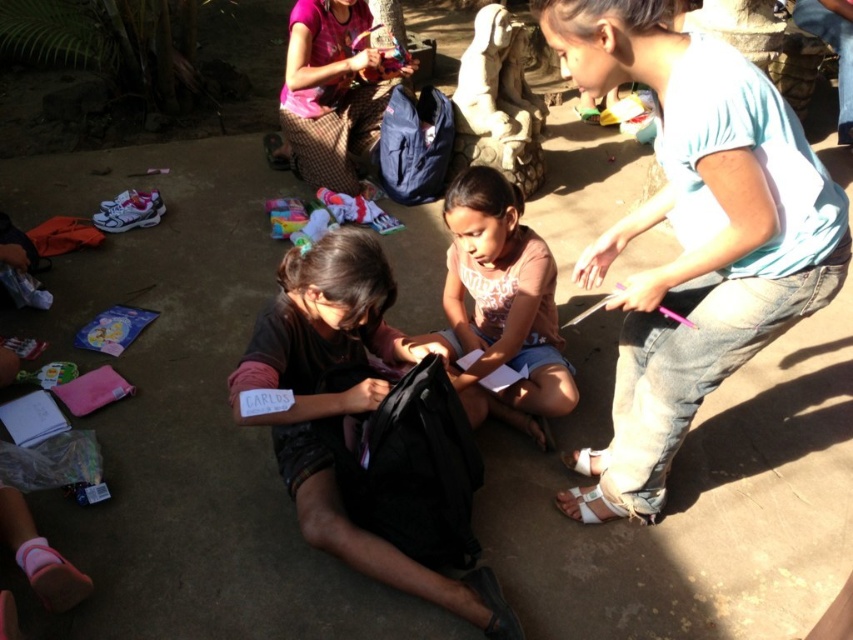
Question: Among these points, which one is farthest from the camera?

Choices:
 (A) (486, 326)
 (B) (802, 141)

Answer: (A)

Question: Which object is farther from the camera taking this photo?

Choices:
 (A) pink fabric at upper center
 (B) pink fabric at center
 (C) blue jeans at lower right

Answer: (A)

Question: Can you confirm if blue jeans at lower right is positioned to the left of pink fabric at upper center?

Choices:
 (A) no
 (B) yes

Answer: (A)

Question: From the image, what is the correct spatial relationship of blue jeans at lower right in relation to pink fabric at upper center?

Choices:
 (A) below
 (B) above

Answer: (A)

Question: Which point is farther to the camera?

Choices:
 (A) blue jeans at lower right
 (B) pink fabric at upper center
 (C) pink fabric at center

Answer: (B)

Question: Does blue jeans at lower right come in front of pink fabric at upper center?

Choices:
 (A) yes
 (B) no

Answer: (A)